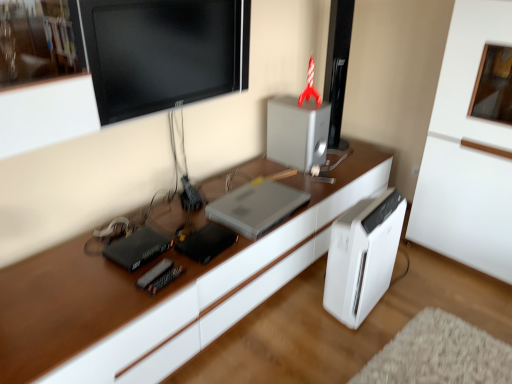
Image resolution: width=512 pixels, height=384 pixels. I want to click on free space above satin silver laptop at center (from a real-world perspective), so click(x=268, y=201).